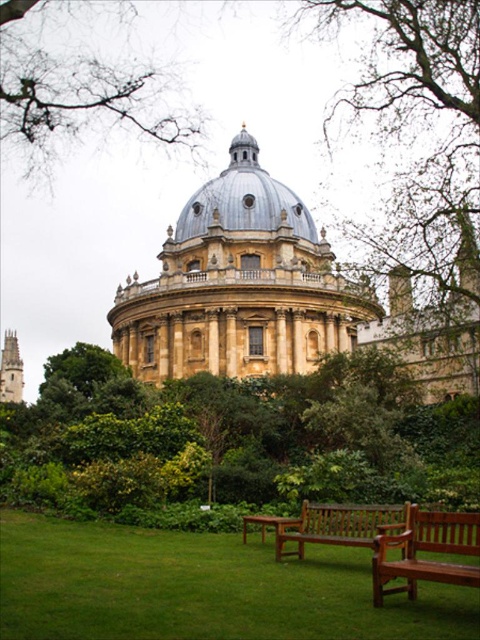
Question: Is brown leafy tree at upper center positioned at the back of wooden park bench at lower center?

Choices:
 (A) yes
 (B) no

Answer: (A)

Question: Among these objects, which one is farthest from the camera?

Choices:
 (A) mahogany wood bench at lower right
 (B) brown leafy tree at upper center
 (C) green grass at lower center

Answer: (B)

Question: Does green leafy tree at center have a greater width compared to brown leafy tree at upper center?

Choices:
 (A) no
 (B) yes

Answer: (B)

Question: Among these points, which one is farthest from the camera?

Choices:
 (A) (445, 449)
 (B) (298, 528)
 (C) (80, 588)
 (D) (416, 540)

Answer: (A)

Question: Which point is farther to the camera?

Choices:
 (A) (283, 186)
 (B) (184, 570)
 (C) (420, 538)
 (D) (168, 259)

Answer: (A)

Question: Is green grass at lower center wider than brown leafy tree at upper center?

Choices:
 (A) yes
 (B) no

Answer: (A)